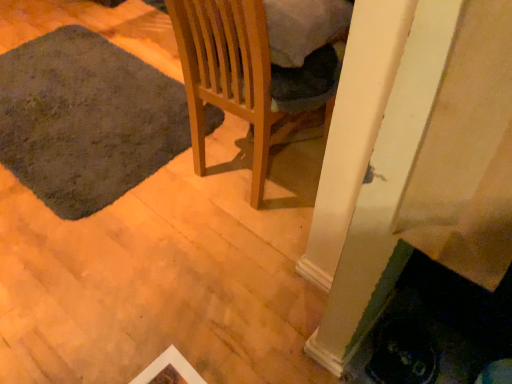
Where is `free area below dark gray carpet at lower left (from a real-world perspective)`? free area below dark gray carpet at lower left (from a real-world perspective) is located at coordinates (84, 102).